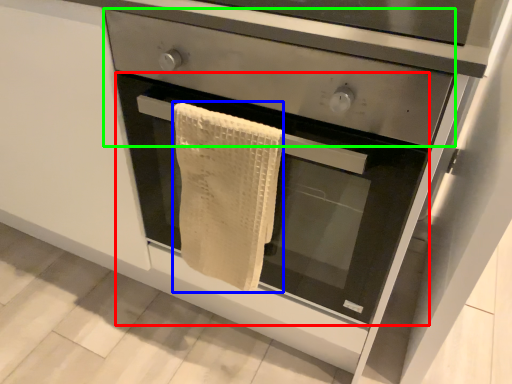
Question: Estimate the real-world distances between objects in this image. Which object is farther from oven (highlighted by a red box), bath towel (highlighted by a blue box) or drawer (highlighted by a green box)?

Choices:
 (A) bath towel
 (B) drawer

Answer: (B)